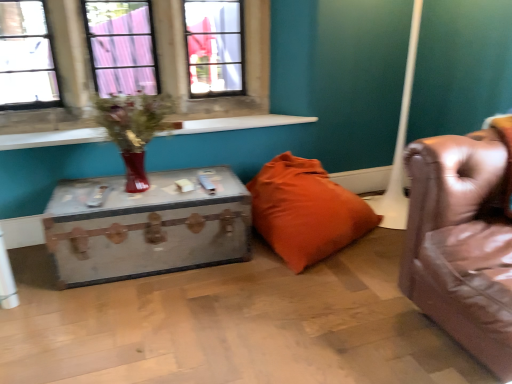
The width and height of the screenshot is (512, 384). Identify the location of vacant location below matte glass vase at upper left (from a real-world perspective). (142, 197).